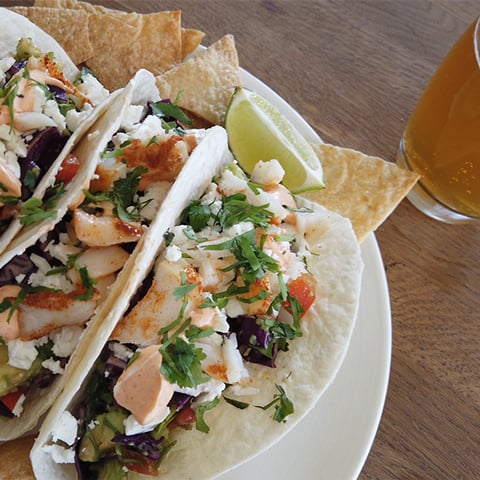
Where is `wooden table`? The image size is (480, 480). wooden table is located at coordinates (447, 396).